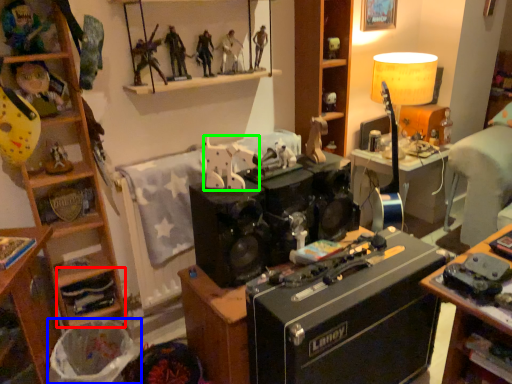
Question: Which is farther away from shelf (highlighted by a red box)? trash bin/can (highlighted by a blue box) or toy (highlighted by a green box)?

Choices:
 (A) trash bin/can
 (B) toy

Answer: (B)